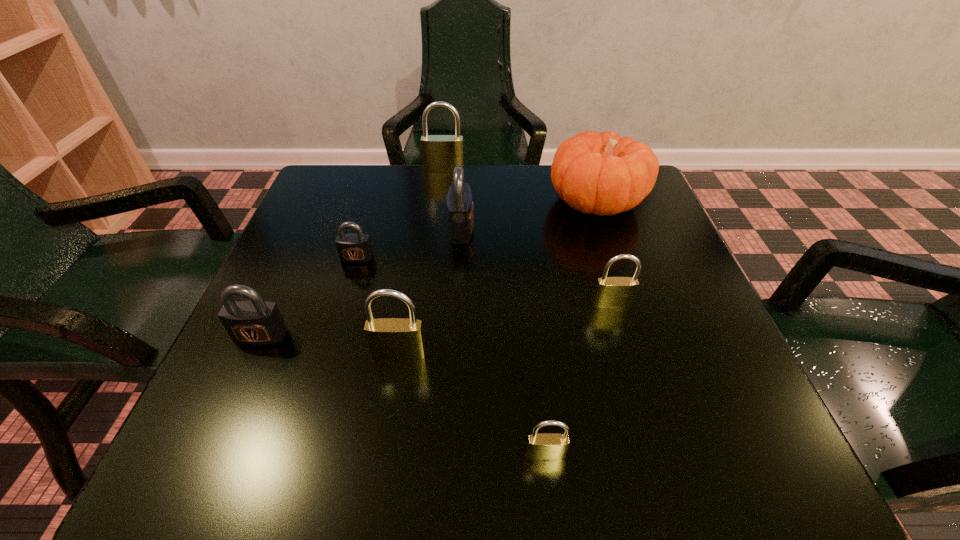
In the image, there is a desktop. At what (x,y) coordinates should I click in order to perform the action: click on vacant space at the right edge. Please return your answer as a coordinate pair (x, y). The height and width of the screenshot is (540, 960). Looking at the image, I should click on (615, 269).

You are a GUI agent. You are given a task and a screenshot of the screen. Output one action in this format:
    pyautogui.click(x=<x>, y=<y>)
    Task: Click on the vacant space at the far left corner
    This screenshot has width=960, height=540.
    Given the screenshot: What is the action you would take?
    pyautogui.click(x=360, y=181)

Where is `unoccupied area between the farthest brass padlock and the rightmost brass padlock`? The image size is (960, 540). unoccupied area between the farthest brass padlock and the rightmost brass padlock is located at coordinates (528, 237).

Locate an element on the screen. The width and height of the screenshot is (960, 540). empty space between the second farthest gray padlock and the second biggest brass padlock is located at coordinates (378, 306).

Image resolution: width=960 pixels, height=540 pixels. Identify the location of blank region between the farthest object and the second farthest brass padlock. (x=528, y=237).

You are a GUI agent. You are given a task and a screenshot of the screen. Output one action in this format:
    pyautogui.click(x=<x>, y=<y>)
    Task: Click on the vacant area between the pumpkin and the farthest gray padlock
    This screenshot has height=540, width=960.
    Given the screenshot: What is the action you would take?
    pyautogui.click(x=529, y=215)

Where is `vacant space that is in between the farthest object and the third farthest padlock`? The width and height of the screenshot is (960, 540). vacant space that is in between the farthest object and the third farthest padlock is located at coordinates coord(400,213).

At what (x,y) coordinates should I click in order to perform the action: click on free area in between the rightmost gray padlock and the third nearest brass padlock. Please return your answer as a coordinate pair (x, y). Image resolution: width=960 pixels, height=540 pixels. Looking at the image, I should click on (537, 266).

Where is `free space between the leftmost padlock and the nearest object`? Image resolution: width=960 pixels, height=540 pixels. free space between the leftmost padlock and the nearest object is located at coordinates (403, 395).

The image size is (960, 540). I want to click on unoccupied area between the farthest padlock and the smallest brass padlock, so click(494, 312).